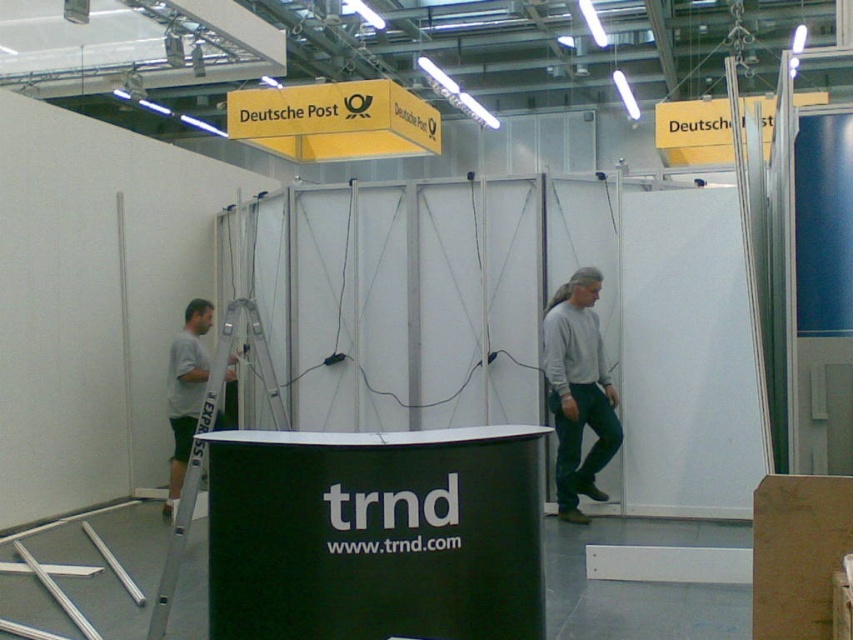
Is gray sweater at center above silver metallic ladder at left?

Yes, gray sweater at center is above silver metallic ladder at left.

Identify the location of gray sweater at center. (578, 390).

This screenshot has width=853, height=640. What are the coordinates of `gray sweater at center` in the screenshot? It's located at (578, 390).

Who is higher up, yellow matte sign at upper center or gray sweater at center?

yellow matte sign at upper center

Who is positioned more to the right, yellow matte sign at upper center or gray sweater at center?

Positioned to the right is gray sweater at center.

This screenshot has height=640, width=853. What do you see at coordinates (334, 120) in the screenshot? I see `yellow matte sign at upper center` at bounding box center [334, 120].

The image size is (853, 640). I want to click on yellow matte sign at upper center, so click(334, 120).

Can you confirm if yellow matte sign at upper center is shorter than yellow paper sign at upper center?

In fact, yellow matte sign at upper center may be taller than yellow paper sign at upper center.

Who is taller, yellow matte sign at upper center or yellow paper sign at upper center?

yellow matte sign at upper center

Does point (358, 147) come closer to viewer compared to point (657, 148)?

Yes.

Find the location of a particular element. Image resolution: width=853 pixels, height=640 pixels. yellow matte sign at upper center is located at coordinates (334, 120).